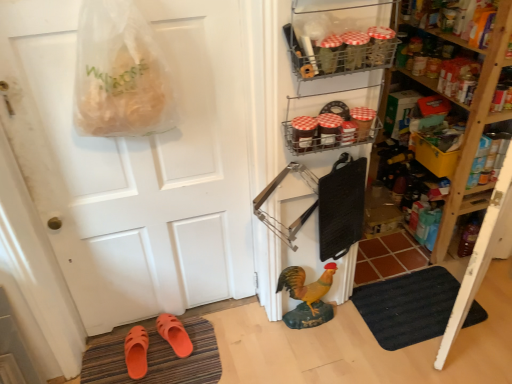
This screenshot has width=512, height=384. In order to click on vacant space underneath painted wood rooster at lower center (from a real-world perspective) in this screenshot , I will do `click(303, 324)`.